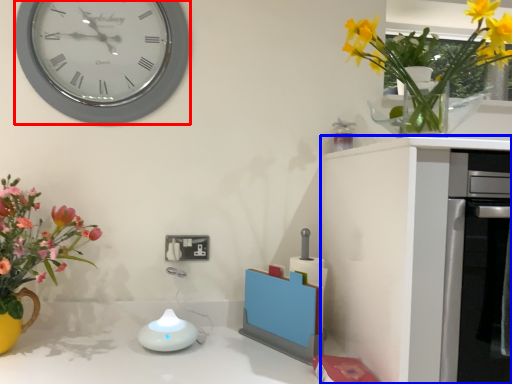
Question: Which point is closer to the camera, wall clock (highlighted by a red box) or cabinetry (highlighted by a blue box)?

Choices:
 (A) wall clock
 (B) cabinetry

Answer: (B)